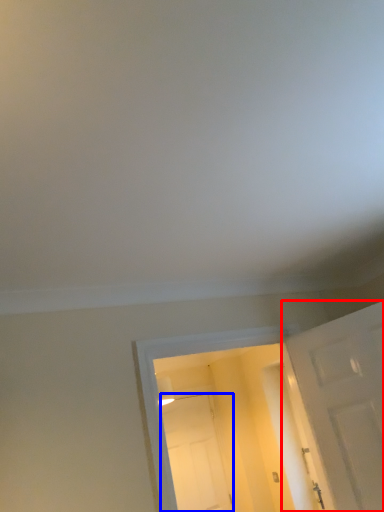
Question: Among these objects, which one is farthest to the camera, door (highlighted by a red box) or door (highlighted by a blue box)?

Choices:
 (A) door
 (B) door

Answer: (B)